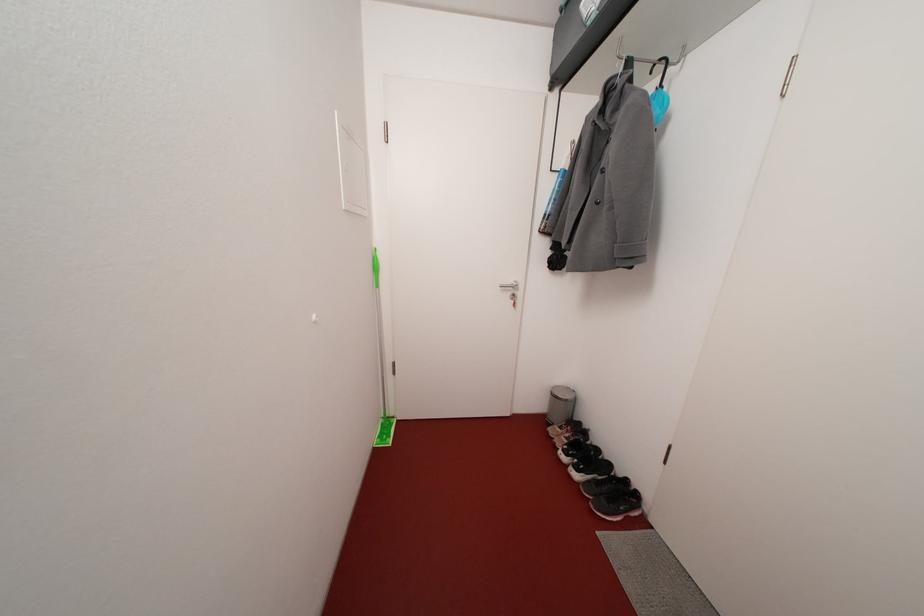
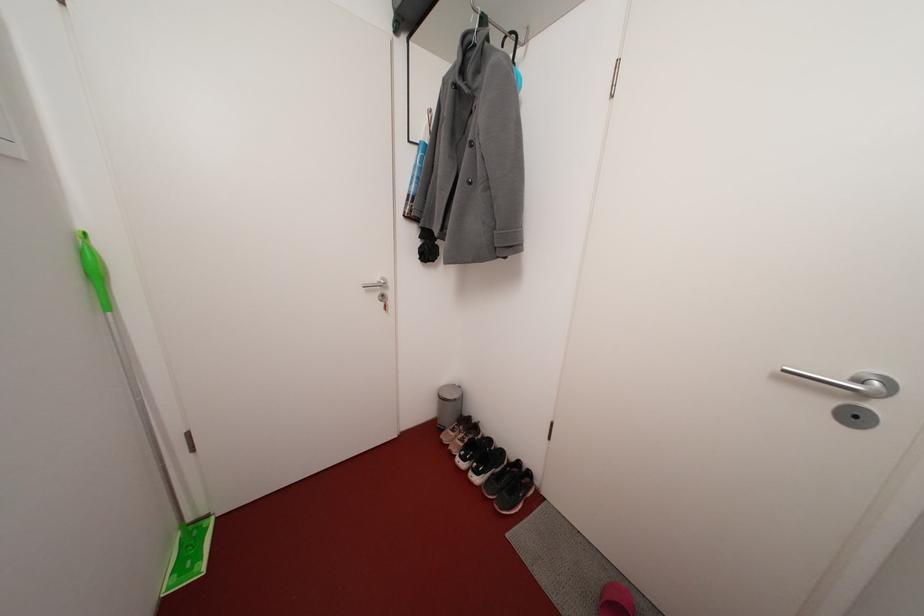
Question: The camera is either moving clockwise (left) or counter-clockwise (right) around the object. The first image is from the beginning of the video and the second image is from the end. Is the camera moving left or right when shooting the video?

Choices:
 (A) Left
 (B) Right

Answer: (A)